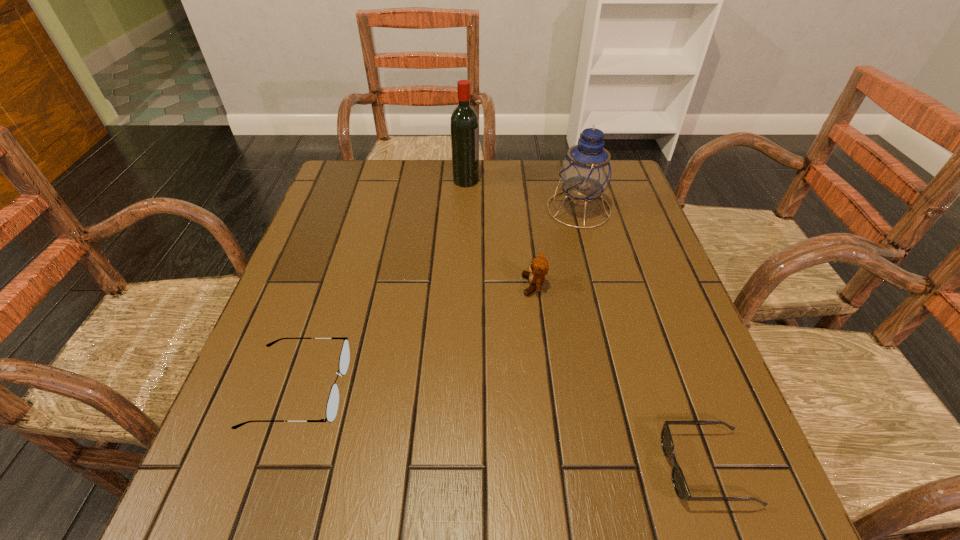
Where is `vacant area situated on the front-facing side of the fourth shortest object`? vacant area situated on the front-facing side of the fourth shortest object is located at coordinates (407, 209).

The height and width of the screenshot is (540, 960). What are the coordinates of `free space located 0.390m on the front-facing side of the fourth shortest object` in the screenshot? It's located at (407, 209).

The height and width of the screenshot is (540, 960). I want to click on free space located on the front-facing side of the fourth shortest object, so click(x=471, y=209).

Locate an element on the screen. vacant area situated 0.330m on the front-facing side of the teddy bear is located at coordinates point(379,286).

You are a GUI agent. You are given a task and a screenshot of the screen. Output one action in this format:
    pyautogui.click(x=<x>, y=<y>)
    Task: Click on the blank space located on the front-facing side of the teddy bear
    The image size is (960, 540).
    Given the screenshot: What is the action you would take?
    pyautogui.click(x=405, y=286)

Identify the location of free spot located 0.110m on the front-facing side of the teddy bear. The image size is (960, 540). (474, 286).

What are the coordinates of `free space located 0.270m on the lenses of the leftmost object` in the screenshot? It's located at (489, 388).

The width and height of the screenshot is (960, 540). Find the location of `free space located at the front lenses of the shortest object`. free space located at the front lenses of the shortest object is located at coordinates (509, 468).

In order to click on free spot located at the front lenses of the shortest object in this screenshot , I will do `click(442, 468)`.

Where is `free space located 0.200m at the front lenses of the shortest object`? free space located 0.200m at the front lenses of the shortest object is located at coordinates (545, 468).